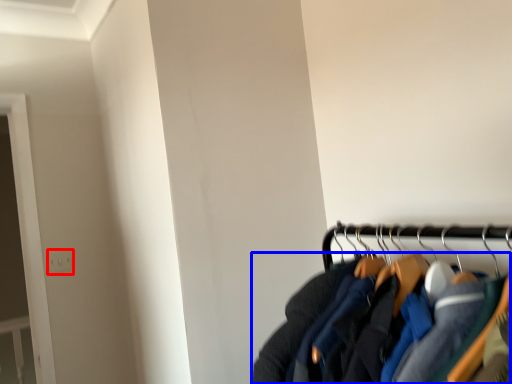
Question: Among these objects, which one is nearest to the camera, electric outlet (highlighted by a red box) or jacket (highlighted by a blue box)?

Choices:
 (A) electric outlet
 (B) jacket

Answer: (B)